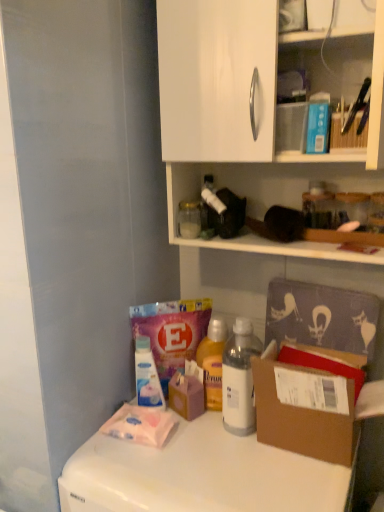
Question: Which direction should I rotate to look at transparent plastic bottle at lower center, arranged as the third bottle when viewed from the top?

Choices:
 (A) right
 (B) left

Answer: (B)

Question: Is brown cardboard box at lower right shorter than white plastic bottle at center, which ranks as the second bottle in top-to-bottom order?

Choices:
 (A) no
 (B) yes

Answer: (B)

Question: Is the surface of brown cardboard box at lower right in direct contact with white plastic bottle at center, the second bottle ordered from the bottom?

Choices:
 (A) yes
 (B) no

Answer: (B)

Question: From the image's perspective, is brown cardboard box at lower right on top of white plastic bottle at center, the third bottle when ordered from left to right?

Choices:
 (A) yes
 (B) no

Answer: (B)

Question: Is brown cardboard box at lower right positioned with its back to white plastic bottle at center, the third bottle when ordered from left to right?

Choices:
 (A) yes
 (B) no

Answer: (B)

Question: Does brown cardboard box at lower right come behind white plastic bottle at center, arranged as the 1th bottle when viewed from the right?

Choices:
 (A) yes
 (B) no

Answer: (B)

Question: Considering the relative positions of brown cardboard box at lower right and white plastic bottle at center, which ranks as the second bottle in top-to-bottom order, in the image provided, is brown cardboard box at lower right in front of white plastic bottle at center, which ranks as the second bottle in top-to-bottom order,?

Choices:
 (A) no
 (B) yes

Answer: (B)

Question: Does clear glass jar at upper center, which is counted as the first bottle, starting from the top, have a lesser width compared to white glossy counter top at lower left?

Choices:
 (A) yes
 (B) no

Answer: (A)

Question: Does clear glass jar at upper center, acting as the second bottle starting from the left, touch white glossy counter top at lower left?

Choices:
 (A) yes
 (B) no

Answer: (B)

Question: Is clear glass jar at upper center, acting as the second bottle starting from the left, oriented away from white glossy counter top at lower left?

Choices:
 (A) yes
 (B) no

Answer: (B)

Question: From the image's perspective, is clear glass jar at upper center, which is counted as the first bottle, starting from the top, on white glossy counter top at lower left?

Choices:
 (A) yes
 (B) no

Answer: (A)

Question: Does clear glass jar at upper center, acting as the second bottle starting from the left, come in front of white glossy counter top at lower left?

Choices:
 (A) no
 (B) yes

Answer: (A)

Question: Is clear glass jar at upper center, the 3th bottle when ordered from bottom to top, to the right of white glossy counter top at lower left from the viewer's perspective?

Choices:
 (A) no
 (B) yes

Answer: (A)

Question: From the image's perspective, is white plastic bottle at center, the second bottle ordered from the bottom, on top of clear glass jar at upper center, the second bottle from the right?

Choices:
 (A) yes
 (B) no

Answer: (B)